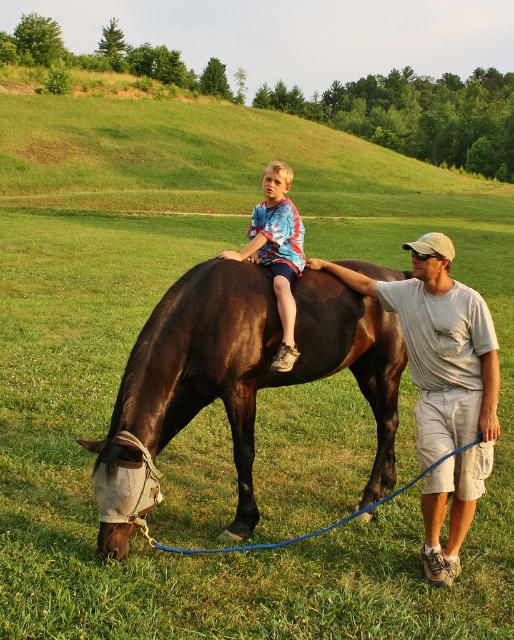
Question: Does light gray cotton t-shirt at right appear over multicolored tie-dye shirt at center?

Choices:
 (A) no
 (B) yes

Answer: (A)

Question: Which point is farther to the camera?

Choices:
 (A) tap(251, 285)
 (B) tap(276, 278)

Answer: (B)

Question: Does light gray cotton t-shirt at right appear on the right side of multicolored tie-dye shirt at center?

Choices:
 (A) yes
 (B) no

Answer: (A)

Question: Is shiny dark brown horse at center above light gray cotton t-shirt at right?

Choices:
 (A) no
 (B) yes

Answer: (A)

Question: Which is farther from the shiny dark brown horse at center?

Choices:
 (A) light gray cotton t-shirt at right
 (B) multicolored tie-dye shirt at center

Answer: (A)

Question: Which point appears closest to the camera in this image?

Choices:
 (A) [x=350, y=280]
 (B) [x=293, y=323]
 (C) [x=139, y=336]

Answer: (B)